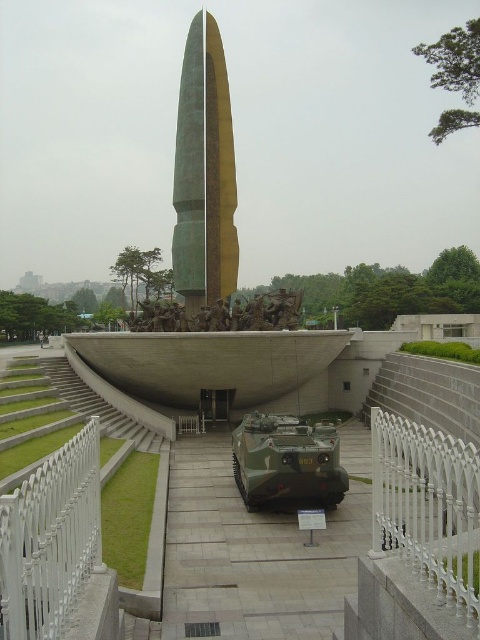
Question: Considering the real-world distances, which object is farthest from the green polished stone obelisk at center?

Choices:
 (A) gray concrete stairs at center
 (B) camouflage paint tank at center

Answer: (B)

Question: Does bronze sculpture at center appear over gray concrete stairs at center?

Choices:
 (A) no
 (B) yes

Answer: (B)

Question: Which point is farther to the camera?

Choices:
 (A) (178, 321)
 (B) (230, 269)

Answer: (B)

Question: Which point is closer to the camera taking this photo?

Choices:
 (A) (269, 321)
 (B) (179, 218)

Answer: (A)

Question: Is camouflage paint tank at center wider than bronze sculpture at center?

Choices:
 (A) no
 (B) yes

Answer: (A)

Question: Is green polished stone obelisk at center smaller than gray concrete stairs at center?

Choices:
 (A) no
 (B) yes

Answer: (A)